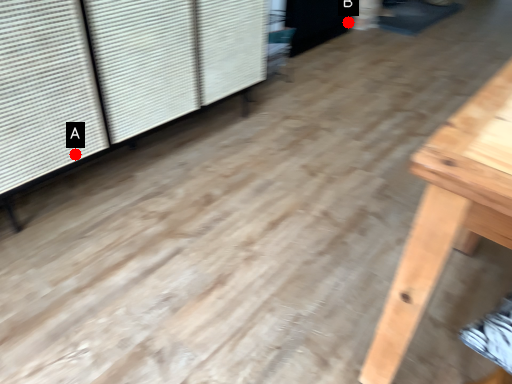
Question: Two points are circled on the image, labeled by A and B beside each circle. Which point is further to the camera?

Choices:
 (A) A is further
 (B) B is further

Answer: (B)